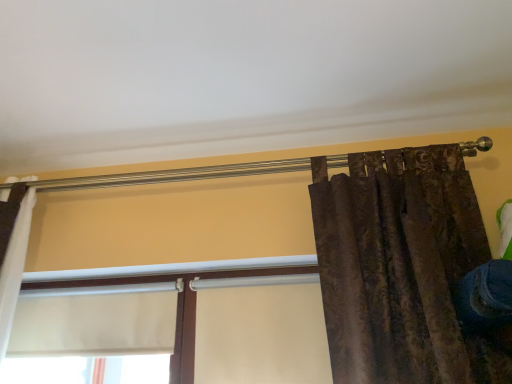
At what (x,y) coordinates should I click in order to perform the action: click on white matte window at center, arranged as the first window when viewed from the left. Please return your answer as a coordinate pair (x, y). Image resolution: width=512 pixels, height=384 pixels. Looking at the image, I should click on (93, 337).

Is white matte window at center, the 2th window positioned from the right, directly adjacent to blue denim jeans at lower right?

No, white matte window at center, the 2th window positioned from the right, is not beside blue denim jeans at lower right.

Considering the sizes of objects white matte window at center, arranged as the first window when viewed from the left, and blue denim jeans at lower right in the image provided, who is shorter, white matte window at center, arranged as the first window when viewed from the left, or blue denim jeans at lower right?

blue denim jeans at lower right.

Is white matte window at center, arranged as the first window when viewed from the left, smaller than blue denim jeans at lower right?

No.

From a real-world perspective, who is located higher, white matte window at center, arranged as the first window when viewed from the left, or blue denim jeans at lower right?

In real-world perspective, white matte window at center, arranged as the first window when viewed from the left, is above.

Can you confirm if white matte window at center, acting as the first window starting from the right, is smaller than blue denim jeans at lower right?

No.

Is the surface of white matte window at center, the 2th window positioned from the left, in direct contact with blue denim jeans at lower right?

No, white matte window at center, the 2th window positioned from the left, is not beside blue denim jeans at lower right.

Between white matte window at center, the 2th window positioned from the left, and blue denim jeans at lower right, which one appears on the right side from the viewer's perspective?

blue denim jeans at lower right is more to the right.

Looking at this image, which object is further away from the camera taking this photo, white matte window at center, the 2th window positioned from the left, or blue denim jeans at lower right?

white matte window at center, the 2th window positioned from the left.

Is the position of white matte window at center, acting as the first window starting from the right, more distant than that of white matte window at center, the 2th window positioned from the right?

No, it is in front of white matte window at center, the 2th window positioned from the right.

Does white matte window at center, acting as the first window starting from the right, have a greater height compared to white matte window at center, the 2th window positioned from the right?

Yes, white matte window at center, acting as the first window starting from the right, is taller than white matte window at center, the 2th window positioned from the right.

I want to click on window that appears behind the white matte window at center, the 2th window positioned from the left, so click(93, 337).

How different are the orientations of white matte window at center, the 2th window positioned from the left, and white matte window at center, arranged as the first window when viewed from the left, in degrees?

The angular difference between white matte window at center, the 2th window positioned from the left, and white matte window at center, arranged as the first window when viewed from the left, is 1.13 degrees.

Looking at this image, is white matte window at center, arranged as the first window when viewed from the left, at the back of blue denim jeans at lower right?

blue denim jeans at lower right does not have its back to white matte window at center, arranged as the first window when viewed from the left.

Consider the image. Is blue denim jeans at lower right situated inside white matte window at center, the 2th window positioned from the right, or outside?

blue denim jeans at lower right lies outside white matte window at center, the 2th window positioned from the right.

From the image's perspective, is blue denim jeans at lower right above or below white matte window at center, the 2th window positioned from the right?

blue denim jeans at lower right is above white matte window at center, the 2th window positioned from the right.

In terms of height, does blue denim jeans at lower right look taller or shorter compared to white matte window at center, arranged as the first window when viewed from the left?

Clearly, blue denim jeans at lower right is shorter compared to white matte window at center, arranged as the first window when viewed from the left.

Which of these two, blue denim jeans at lower right or white matte window at center, the 2th window positioned from the left, stands shorter?

blue denim jeans at lower right is shorter.

From a real-world perspective, is blue denim jeans at lower right physically above white matte window at center, the 2th window positioned from the left?

Actually, blue denim jeans at lower right is physically below white matte window at center, the 2th window positioned from the left, in the real world.

Is blue denim jeans at lower right looking in the opposite direction of white matte window at center, acting as the first window starting from the right?

No, blue denim jeans at lower right is not facing away from white matte window at center, acting as the first window starting from the right.

Do you think blue denim jeans at lower right is within white matte window at center, the 2th window positioned from the left, or outside of it?

blue denim jeans at lower right is located beyond the bounds of white matte window at center, the 2th window positioned from the left.

Does point (146, 346) appear closer or farther from the camera than point (141, 299)?

Point (146, 346) is closer to the camera than point (141, 299).

Is white matte window at center, arranged as the first window when viewed from the left, situated inside white matte window at center, acting as the first window starting from the right, or outside?

white matte window at center, arranged as the first window when viewed from the left, fits inside white matte window at center, acting as the first window starting from the right.

Between white matte window at center, arranged as the first window when viewed from the left, and white matte window at center, acting as the first window starting from the right, which one has smaller size?

white matte window at center, arranged as the first window when viewed from the left.

Can you confirm if white matte window at center, arranged as the first window when viewed from the left, is positioned to the right of white matte window at center, the 2th window positioned from the left?

In fact, white matte window at center, arranged as the first window when viewed from the left, is to the left of white matte window at center, the 2th window positioned from the left.

Where is `window that is the 1st one when counting downward from the blue denim jeans at lower right (from the image's perspective)`? The width and height of the screenshot is (512, 384). window that is the 1st one when counting downward from the blue denim jeans at lower right (from the image's perspective) is located at coordinates (93, 337).

The height and width of the screenshot is (384, 512). Identify the location of jeans that is under the white matte window at center, the 2th window positioned from the left (from a real-world perspective). (484, 296).

Looking at the image, which one is located further to blue denim jeans at lower right, white matte window at center, the 2th window positioned from the right, or white matte window at center, acting as the first window starting from the right?

The object further to blue denim jeans at lower right is white matte window at center, the 2th window positioned from the right.

Based on their spatial positions, is white matte window at center, the 2th window positioned from the right, or blue denim jeans at lower right closer to white matte window at center, acting as the first window starting from the right?

white matte window at center, the 2th window positioned from the right, is positioned closer to the anchor white matte window at center, acting as the first window starting from the right.

Considering their positions, is blue denim jeans at lower right positioned closer to white matte window at center, acting as the first window starting from the right, than white matte window at center, the 2th window positioned from the right?

Among the two, white matte window at center, the 2th window positioned from the right, is located nearer to white matte window at center, acting as the first window starting from the right.

Considering their positions, is white matte window at center, the 2th window positioned from the left, positioned further to blue denim jeans at lower right than white matte window at center, the 2th window positioned from the right?

white matte window at center, the 2th window positioned from the right, is further to blue denim jeans at lower right.

Based on their spatial positions, is white matte window at center, the 2th window positioned from the left, or blue denim jeans at lower right further from white matte window at center, arranged as the first window when viewed from the left?

Among the two, blue denim jeans at lower right is located further to white matte window at center, arranged as the first window when viewed from the left.

Which object lies nearer to the anchor point white matte window at center, the 2th window positioned from the right, blue denim jeans at lower right or white matte window at center, acting as the first window starting from the right?

white matte window at center, acting as the first window starting from the right, lies closer to white matte window at center, the 2th window positioned from the right, than the other object.

At what (x,y) coordinates should I click in order to perform the action: click on window located between white matte window at center, the 2th window positioned from the right, and blue denim jeans at lower right in the left-right direction. Please return your answer as a coordinate pair (x, y). The height and width of the screenshot is (384, 512). Looking at the image, I should click on (260, 328).